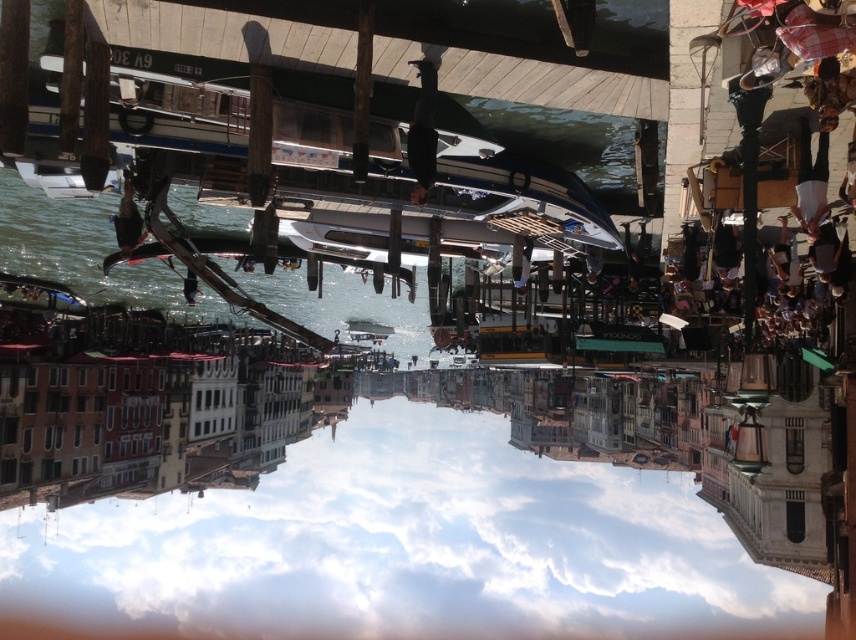
Question: Which of these objects is positioned closest to the white glossy boat at center?

Choices:
 (A) metallic silver boat at center
 (B) clear water at lower left

Answer: (B)

Question: Which point is farther to the camera?

Choices:
 (A) clear water at lower left
 (B) white glossy boat at center

Answer: (B)

Question: Does metallic silver boat at center have a greater width compared to white glossy boat at center?

Choices:
 (A) yes
 (B) no

Answer: (A)

Question: Which of these objects is positioned closest to the clear water at lower left?

Choices:
 (A) metallic silver boat at center
 (B) white glossy boat at center

Answer: (B)

Question: Does clear water at lower left have a greater width compared to metallic silver boat at center?

Choices:
 (A) no
 (B) yes

Answer: (B)

Question: Does clear water at lower left appear on the left side of white glossy boat at center?

Choices:
 (A) yes
 (B) no

Answer: (A)